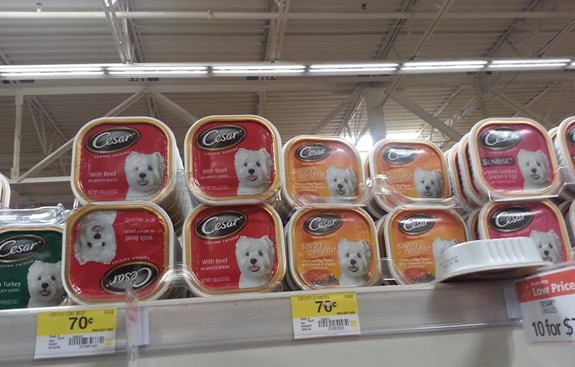
The width and height of the screenshot is (575, 367). I want to click on lights, so click(90, 68), click(170, 72), click(272, 71), click(368, 72), click(452, 69), click(513, 67).